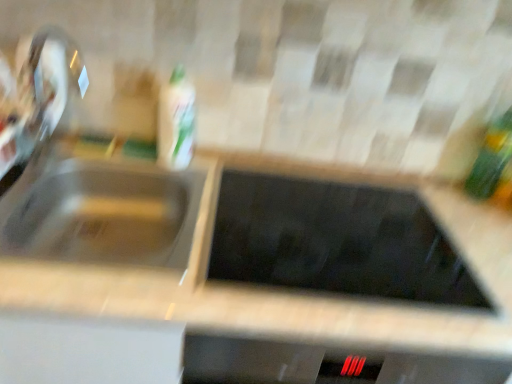
Where is `white glossy bottle at upper center, marked as the second bottle in a right-to-left arrangement`? The height and width of the screenshot is (384, 512). white glossy bottle at upper center, marked as the second bottle in a right-to-left arrangement is located at coordinates (176, 121).

Identify the location of satin silver sink at left. Image resolution: width=512 pixels, height=384 pixels. (106, 215).

At what (x,y) coordinates should I click in order to perform the action: click on green glass bottle at right, the 1th bottle viewed from the right. Please return your answer as a coordinate pair (x, y). This screenshot has height=384, width=512. Looking at the image, I should click on (494, 164).

Where is `satin nickel faucet at left`? The height and width of the screenshot is (384, 512). satin nickel faucet at left is located at coordinates (37, 99).

Is green glass bottle at right, the 1th bottle viewed from the right, inside the boundaries of satin silver sink at left, or outside?

green glass bottle at right, the 1th bottle viewed from the right, exists outside the volume of satin silver sink at left.

Which of these two, green glass bottle at right, the 2th bottle positioned from the left, or satin silver sink at left, is thinner?

With smaller width is green glass bottle at right, the 2th bottle positioned from the left.

Is green glass bottle at right, the 2th bottle positioned from the left, oriented away from satin silver sink at left?

No, green glass bottle at right, the 2th bottle positioned from the left, is not facing away from satin silver sink at left.

Is green glass bottle at right, the 1th bottle viewed from the right, further to the viewer compared to satin silver sink at left?

Yes, it is.

At what (x,y) coordinates should I click in order to perform the action: click on faucet above the green glass bottle at right, the 1th bottle viewed from the right (from a real-world perspective). Please return your answer as a coordinate pair (x, y). The image size is (512, 384). Looking at the image, I should click on (37, 99).

Could you tell me if satin nickel faucet at left is facing green glass bottle at right, the 2th bottle positioned from the left?

Yes.

Which object is wider, satin nickel faucet at left or green glass bottle at right, the 1th bottle viewed from the right?

With larger width is satin nickel faucet at left.

Does satin nickel faucet at left have a lesser height compared to green glass bottle at right, the 2th bottle positioned from the left?

Incorrect, the height of satin nickel faucet at left does not fall short of that of green glass bottle at right, the 2th bottle positioned from the left.

Could you measure the distance between satin silver sink at left and white glossy bottle at upper center, which is the 1th bottle in left-to-right order?

satin silver sink at left is 19.60 centimeters away from white glossy bottle at upper center, which is the 1th bottle in left-to-right order.

From the picture: Is satin silver sink at left oriented away from white glossy bottle at upper center, which is the 1th bottle in left-to-right order?

That's not correct — satin silver sink at left is not looking away from white glossy bottle at upper center, which is the 1th bottle in left-to-right order.

Are satin silver sink at left and white glossy bottle at upper center, marked as the second bottle in a right-to-left arrangement, located far from each other?

They are positioned close to each other.

Considering their positions, is satin silver sink at left located in front of or behind white glossy bottle at upper center, which is the 1th bottle in left-to-right order?

satin silver sink at left is positioned closer to the viewer than white glossy bottle at upper center, which is the 1th bottle in left-to-right order.

Between satin nickel faucet at left and satin silver sink at left, which one has less height?

With less height is satin silver sink at left.

Can you tell me how much satin nickel faucet at left and satin silver sink at left differ in facing direction?

There is a 93.9-degree angle between the facing directions of satin nickel faucet at left and satin silver sink at left.

In the scene shown: Is satin nickel faucet at left inside the boundaries of satin silver sink at left, or outside?

satin nickel faucet at left is outside satin silver sink at left.

From the image's perspective, which is below, satin nickel faucet at left or satin silver sink at left?

satin silver sink at left.

Which object is thinner, green glass bottle at right, the 1th bottle viewed from the right, or white glossy bottle at upper center, marked as the second bottle in a right-to-left arrangement?

green glass bottle at right, the 1th bottle viewed from the right.

Between green glass bottle at right, the 1th bottle viewed from the right, and white glossy bottle at upper center, marked as the second bottle in a right-to-left arrangement, which one appears on the left side from the viewer's perspective?

Positioned to the left is white glossy bottle at upper center, marked as the second bottle in a right-to-left arrangement.

Between satin silver sink at left and satin nickel faucet at left, which one has larger size?

satin silver sink at left.

Is satin silver sink at left oriented towards satin nickel faucet at left?

No, satin silver sink at left is not oriented towards satin nickel faucet at left.

Find the location of a particular element. sink that is under the satin nickel faucet at left (from a real-world perspective) is located at coordinates (106, 215).

In the image, is satin nickel faucet at left on the left side or the right side of white glossy bottle at upper center, marked as the second bottle in a right-to-left arrangement?

Clearly, satin nickel faucet at left is on the left of white glossy bottle at upper center, marked as the second bottle in a right-to-left arrangement, in the image.

Find the location of a particular element. The height and width of the screenshot is (384, 512). faucet above the white glossy bottle at upper center, which is the 1th bottle in left-to-right order (from a real-world perspective) is located at coordinates (37, 99).

From the image's perspective, is satin nickel faucet at left above white glossy bottle at upper center, marked as the second bottle in a right-to-left arrangement?

No.

Based on the photo, can you see satin nickel faucet at left touching white glossy bottle at upper center, which is the 1th bottle in left-to-right order?

No, satin nickel faucet at left is not touching white glossy bottle at upper center, which is the 1th bottle in left-to-right order.

The width and height of the screenshot is (512, 384). I want to click on sink in front of the green glass bottle at right, the 2th bottle positioned from the left, so click(106, 215).

The image size is (512, 384). In the image, there is a green glass bottle at right, the 2th bottle positioned from the left. Find the location of `faucet above it (from the image's perspective)`. faucet above it (from the image's perspective) is located at coordinates (37, 99).

Estimate the real-world distances between objects in this image. Which object is closer to satin silver sink at left, satin nickel faucet at left or green glass bottle at right, the 2th bottle positioned from the left?

Among the two, satin nickel faucet at left is located nearer to satin silver sink at left.

Consider the image. When comparing their distances from satin nickel faucet at left, does green glass bottle at right, the 1th bottle viewed from the right, or satin silver sink at left seem further?

Among the two, green glass bottle at right, the 1th bottle viewed from the right, is located further to satin nickel faucet at left.

When comparing their distances from white glossy bottle at upper center, which is the 1th bottle in left-to-right order, does satin silver sink at left or green glass bottle at right, the 1th bottle viewed from the right, seem further?

green glass bottle at right, the 1th bottle viewed from the right, is further to white glossy bottle at upper center, which is the 1th bottle in left-to-right order.

When comparing their distances from green glass bottle at right, the 1th bottle viewed from the right, does white glossy bottle at upper center, which is the 1th bottle in left-to-right order, or satin nickel faucet at left seem further?

satin nickel faucet at left is further to green glass bottle at right, the 1th bottle viewed from the right.

Looking at this image, when comparing their distances from white glossy bottle at upper center, which is the 1th bottle in left-to-right order, does satin silver sink at left or satin nickel faucet at left seem closer?

satin silver sink at left is closer to white glossy bottle at upper center, which is the 1th bottle in left-to-right order.

When comparing their distances from satin nickel faucet at left, does white glossy bottle at upper center, which is the 1th bottle in left-to-right order, or satin silver sink at left seem closer?

The object closer to satin nickel faucet at left is satin silver sink at left.

When comparing their distances from satin silver sink at left, does satin nickel faucet at left or white glossy bottle at upper center, marked as the second bottle in a right-to-left arrangement, seem further?

satin nickel faucet at left is further to satin silver sink at left.

From the picture: Which object lies nearer to the anchor point satin nickel faucet at left, green glass bottle at right, the 2th bottle positioned from the left, or white glossy bottle at upper center, marked as the second bottle in a right-to-left arrangement?

Based on the image, white glossy bottle at upper center, marked as the second bottle in a right-to-left arrangement, appears to be nearer to satin nickel faucet at left.

Find the location of a particular element. This screenshot has height=384, width=512. bottle situated between satin nickel faucet at left and green glass bottle at right, the 2th bottle positioned from the left, from left to right is located at coordinates (176, 121).

The image size is (512, 384). In order to click on sink between satin nickel faucet at left and green glass bottle at right, the 2th bottle positioned from the left in this screenshot , I will do 106,215.

The height and width of the screenshot is (384, 512). In order to click on bottle between satin silver sink at left and green glass bottle at right, the 1th bottle viewed from the right, from left to right in this screenshot , I will do `click(176, 121)`.

Where is `faucet between white glossy bottle at upper center, marked as the second bottle in a right-to-left arrangement, and satin silver sink at left in the up-down direction`? Image resolution: width=512 pixels, height=384 pixels. faucet between white glossy bottle at upper center, marked as the second bottle in a right-to-left arrangement, and satin silver sink at left in the up-down direction is located at coordinates (37, 99).